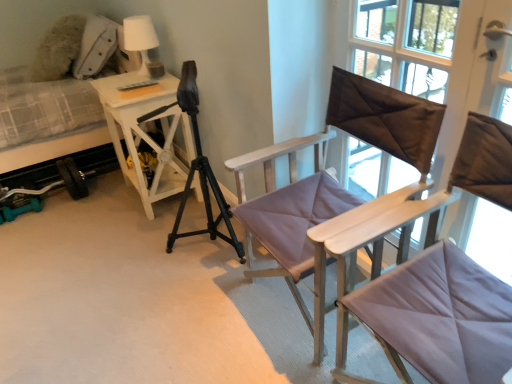
Question: Does plush fabric hospital bed at left appear on the left side of brown satin pillow at upper right?

Choices:
 (A) yes
 (B) no

Answer: (A)

Question: From the image's perspective, is plush fabric hospital bed at left below brown satin pillow at upper right?

Choices:
 (A) no
 (B) yes

Answer: (A)

Question: Is plush fabric hospital bed at left at the right side of brown satin pillow at upper right?

Choices:
 (A) yes
 (B) no

Answer: (B)

Question: Is plush fabric hospital bed at left thinner than brown satin pillow at upper right?

Choices:
 (A) no
 (B) yes

Answer: (A)

Question: Are plush fabric hospital bed at left and brown satin pillow at upper right located far from each other?

Choices:
 (A) yes
 (B) no

Answer: (A)

Question: Visually, is brown satin pillow at upper right positioned to the left or to the right of white matte table lamp at upper left?

Choices:
 (A) left
 (B) right

Answer: (B)

Question: Is brown satin pillow at upper right spatially inside white matte table lamp at upper left, or outside of it?

Choices:
 (A) outside
 (B) inside

Answer: (A)

Question: Considering the positions of brown satin pillow at upper right and white matte table lamp at upper left in the image, is brown satin pillow at upper right taller or shorter than white matte table lamp at upper left?

Choices:
 (A) short
 (B) tall

Answer: (B)

Question: From the image's perspective, is brown satin pillow at upper right located above or below white matte table lamp at upper left?

Choices:
 (A) below
 (B) above

Answer: (A)

Question: Considering the positions of matte purple cushioned chair at center, which is the second chair from back to front, and plush fabric hospital bed at left in the image, is matte purple cushioned chair at center, which is the second chair from back to front, bigger or smaller than plush fabric hospital bed at left?

Choices:
 (A) small
 (B) big

Answer: (A)

Question: Looking at their shapes, would you say matte purple cushioned chair at center, which is the second chair from back to front, is wider or thinner than plush fabric hospital bed at left?

Choices:
 (A) thin
 (B) wide

Answer: (A)

Question: Is point (480, 192) positioned closer to the camera than point (10, 188)?

Choices:
 (A) closer
 (B) farther

Answer: (A)

Question: From their relative heights in the image, would you say matte purple cushioned chair at center, which is the second chair from back to front, is taller or shorter than plush fabric hospital bed at left?

Choices:
 (A) tall
 (B) short

Answer: (B)

Question: From a real-world perspective, is matte purple cushioned chair at center, which is the second chair from back to front, physically located above or below light purple fabric chair at center, which is the 2th chair from front to back?

Choices:
 (A) below
 (B) above

Answer: (A)

Question: Is matte purple cushioned chair at center, which is the second chair from back to front, situated inside light purple fabric chair at center, marked as the 1th chair in a back-to-front arrangement, or outside?

Choices:
 (A) outside
 (B) inside

Answer: (A)